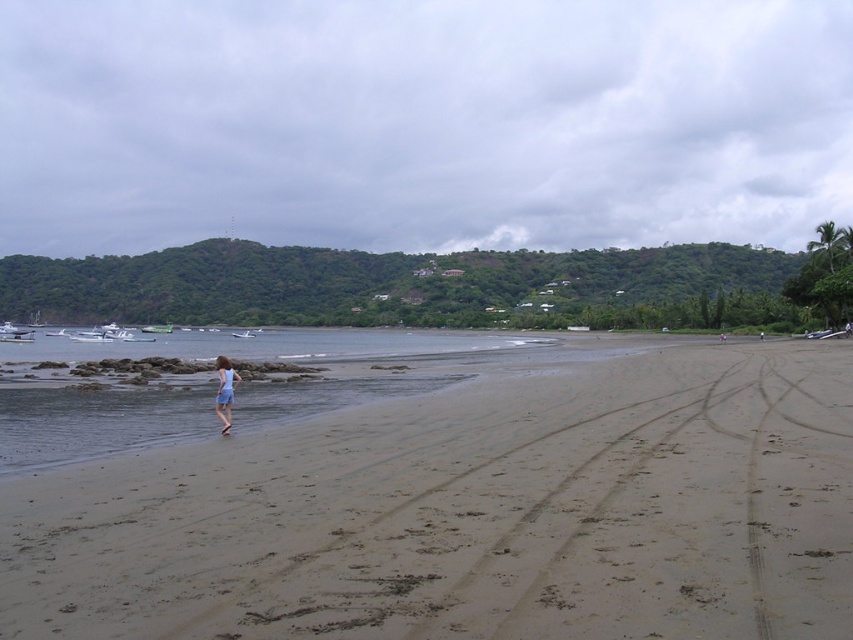
You are standing on the sandy beach at lower left and want to reach the light blue fabric dress at center. Which direction should you walk to get closer to the dress?

Since the sandy beach at lower left is in front of the light blue fabric dress at center, you should walk towards the dress by moving backward away from the beach.